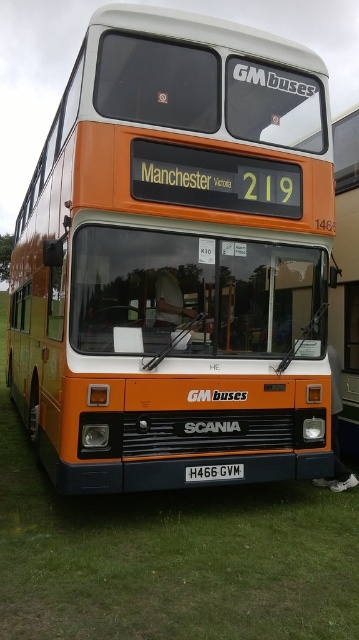
Question: Which point is closer to the camera?

Choices:
 (A) (28, 400)
 (B) (190, 465)

Answer: (B)

Question: Can you confirm if orange matte bus at center is bigger than white rectangular license plate at center?

Choices:
 (A) no
 (B) yes

Answer: (A)

Question: Can you confirm if orange matte bus at center is bigger than white rectangular license plate at center?

Choices:
 (A) yes
 (B) no

Answer: (B)

Question: Is orange matte bus at center above white rectangular license plate at center?

Choices:
 (A) no
 (B) yes

Answer: (B)

Question: Which point is closer to the camera taking this photo?

Choices:
 (A) (231, 476)
 (B) (178, 392)

Answer: (B)